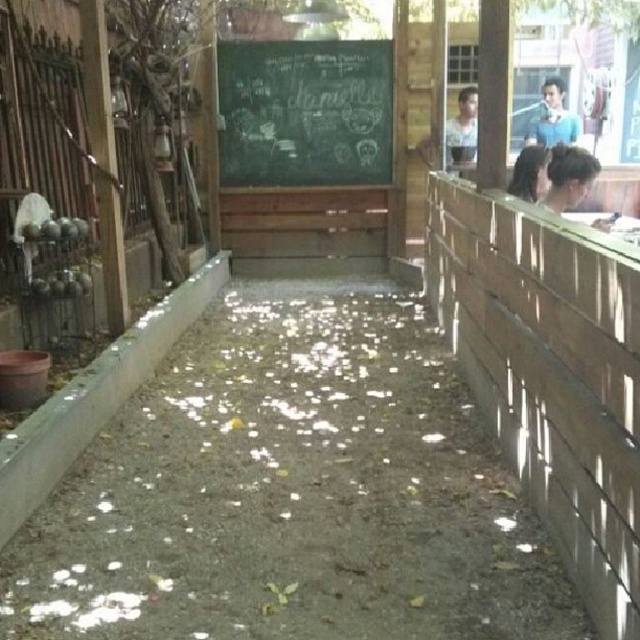
Is wooden fence at right below blue shirt at upper right?

Yes.

Which is above, wooden fence at right or blue shirt at upper right?

Positioned higher is blue shirt at upper right.

Does point (467, 276) lie behind point (561, 120)?

No, it is not.

Image resolution: width=640 pixels, height=640 pixels. I want to click on wooden fence at right, so click(550, 372).

This screenshot has width=640, height=640. What do you see at coordinates (550, 372) in the screenshot?
I see `wooden fence at right` at bounding box center [550, 372].

Where is `wooden fence at right`? The height and width of the screenshot is (640, 640). wooden fence at right is located at coordinates (550, 372).

Does black chalkboard at center have a larger size compared to blue shirt at upper right?

Yes, black chalkboard at center is bigger than blue shirt at upper right.

What do you see at coordinates (305, 113) in the screenshot? This screenshot has height=640, width=640. I see `black chalkboard at center` at bounding box center [305, 113].

Where is `black chalkboard at center`? The height and width of the screenshot is (640, 640). black chalkboard at center is located at coordinates (305, 113).